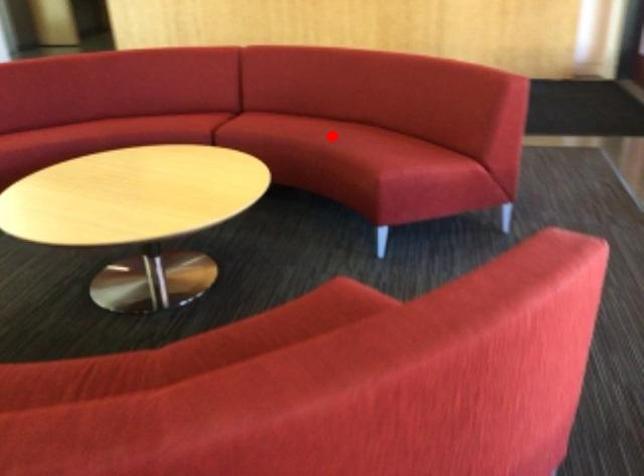
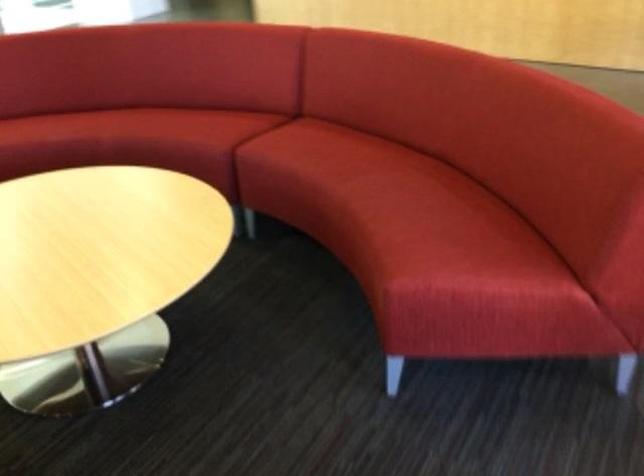
Where in the second image is the point corresponding to the highlighted location from the first image?

(370, 186)